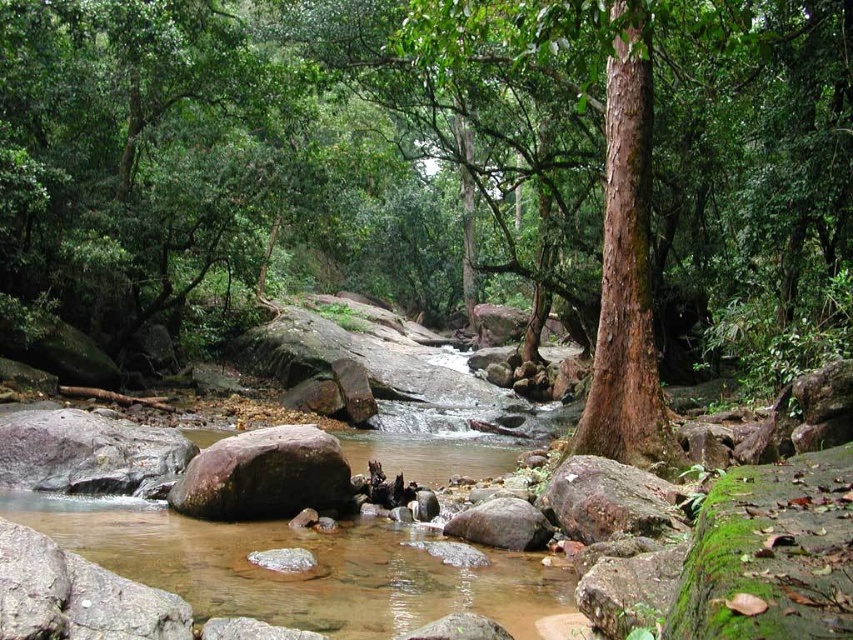
Question: Does brown rough tree at center have a smaller size compared to green mossy rock at center?

Choices:
 (A) no
 (B) yes

Answer: (A)

Question: Observing the image, what is the correct spatial positioning of brown rough tree at center in reference to green mossy rock at center?

Choices:
 (A) above
 (B) below

Answer: (A)

Question: Where is brown rough tree at center located in relation to green mossy rock at center in the image?

Choices:
 (A) right
 (B) left

Answer: (A)

Question: Which point is closer to the camera?

Choices:
 (A) brown rough tree at center
 (B) green mossy rock at center

Answer: (A)

Question: Among these objects, which one is farthest from the camera?

Choices:
 (A) brown rough tree at center
 (B) green mossy rock at center

Answer: (B)